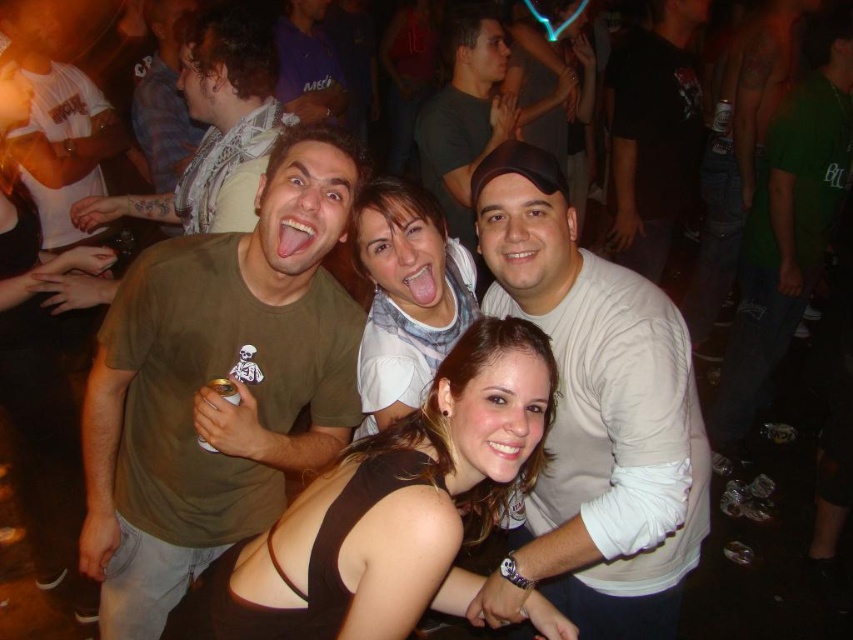
Is the position of white matte shirt at center more distant than that of light brown scarf at upper left?

No, it is not.

What do you see at coordinates (593, 417) in the screenshot? I see `white matte shirt at center` at bounding box center [593, 417].

Locate an element on the screen. white matte shirt at center is located at coordinates (593, 417).

Is green matte t-shirt at center shorter than white scarf at center?

No, green matte t-shirt at center is not shorter than white scarf at center.

Is green matte t-shirt at center above white scarf at center?

No, green matte t-shirt at center is not above white scarf at center.

Is point (202, 410) farther from viewer compared to point (354, 237)?

No, it is in front of (354, 237).

Locate an element on the screen. This screenshot has width=853, height=640. green matte t-shirt at center is located at coordinates click(x=212, y=385).

Does green cotton shirt at right appear over matte green t-shirt at upper center?

Actually, green cotton shirt at right is below matte green t-shirt at upper center.

Is green cotton shirt at right positioned behind matte green t-shirt at upper center?

No, green cotton shirt at right is closer to the viewer.

Does point (791, 321) come closer to viewer compared to point (445, 218)?

Yes.

Identify the location of green cotton shirt at right. Image resolution: width=853 pixels, height=640 pixels. (786, 230).